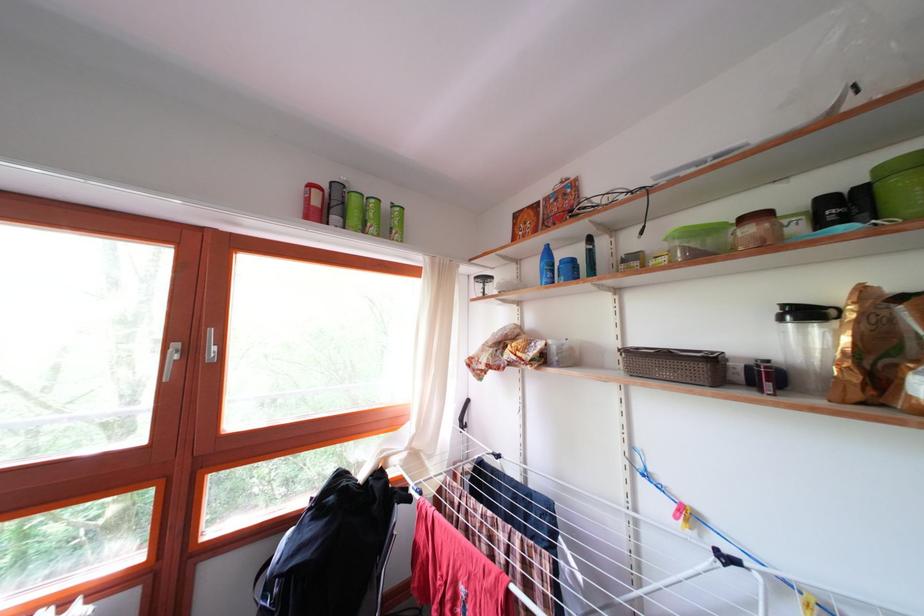
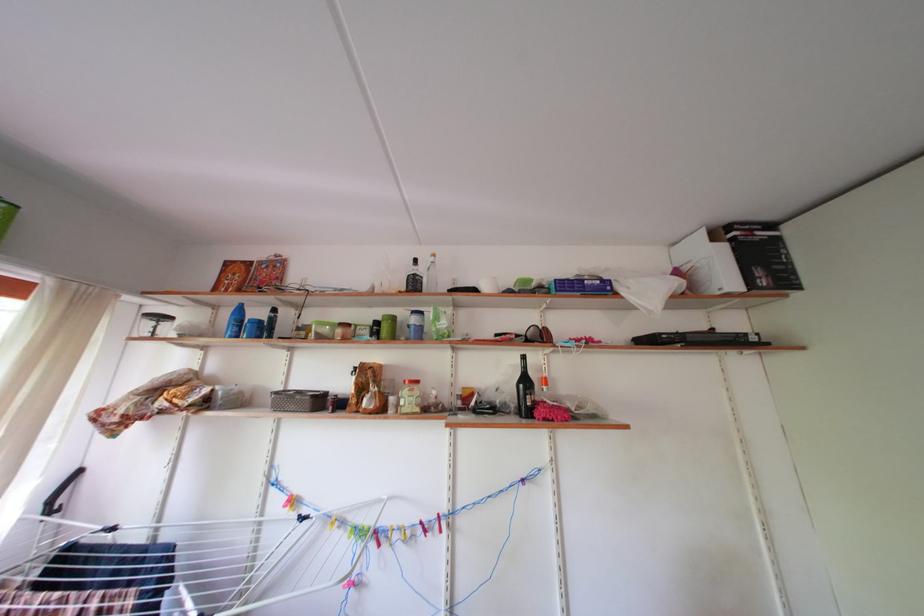
Locate, in the second image, the point that corresponds to point 816,213 in the first image.

(380, 330)